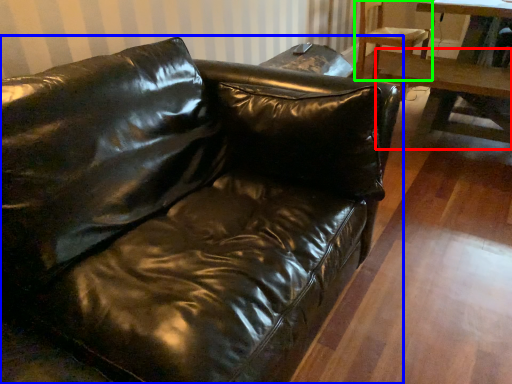
Question: Based on their relative distances, which object is nearer to table (highlighted by a red box)? Choose from studio couch (highlighted by a blue box) and chair (highlighted by a green box).

Choices:
 (A) studio couch
 (B) chair

Answer: (B)